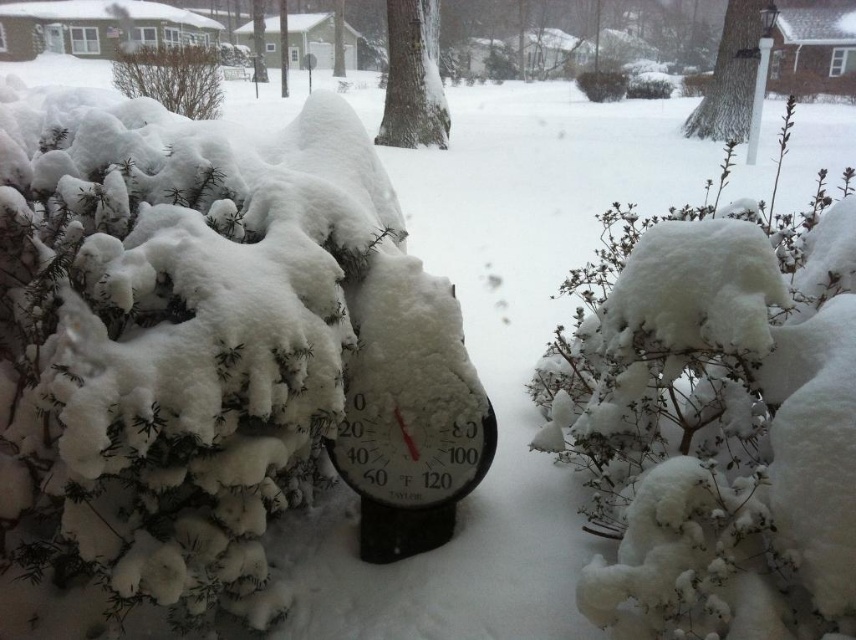
Question: Among these points, which one is farthest from the camera?

Choices:
 (A) (721, 113)
 (B) (198, 90)

Answer: (A)

Question: Does smooth bark tree at center appear under smooth bark tree at upper right?

Choices:
 (A) no
 (B) yes

Answer: (B)

Question: Estimate the real-world distances between objects in this image. Which object is closer to the smooth bark tree at center?

Choices:
 (A) smooth bark tree at upper right
 (B) brown textured bush at upper left

Answer: (B)

Question: Considering the relative positions of smooth bark tree at center and smooth bark tree at upper right in the image provided, where is smooth bark tree at center located with respect to smooth bark tree at upper right?

Choices:
 (A) left
 (B) right

Answer: (A)

Question: Is smooth bark tree at upper right positioned before brown textured bush at upper left?

Choices:
 (A) no
 (B) yes

Answer: (A)

Question: Which point is closer to the camera?

Choices:
 (A) (708, 88)
 (B) (396, 74)
 (C) (129, 84)

Answer: (B)